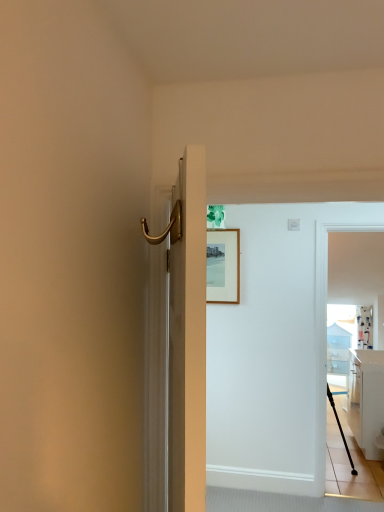
This screenshot has height=512, width=384. Describe the element at coordinates (325, 326) in the screenshot. I see `white glossy screen door at right` at that location.

What do you see at coordinates (364, 327) in the screenshot?
I see `white fabric curtain at upper right` at bounding box center [364, 327].

This screenshot has width=384, height=512. In order to click on wooden picture frame at upper center in this screenshot , I will do `click(223, 266)`.

This screenshot has width=384, height=512. I want to click on white glossy cabinet at right, so click(366, 399).

In order to face black rubber cane at right, should I rotate leftwards or rightwards?

To face it directly, rotate right by 18.050 degrees.

The image size is (384, 512). In order to click on white glossy countertop at right in this screenshot , I will do `click(369, 356)`.

Considering the positions of objects black matte tripod at lower right and white fabric curtain at upper right in the image provided, who is in front, black matte tripod at lower right or white fabric curtain at upper right?

black matte tripod at lower right is more forward.

Is black matte tripod at lower right smaller than white fabric curtain at upper right?

Actually, black matte tripod at lower right might be larger than white fabric curtain at upper right.

In the scene shown: From the image's perspective, is black matte tripod at lower right below white fabric curtain at upper right?

Correct, black matte tripod at lower right appears lower than white fabric curtain at upper right in the image.

Who is shorter, wooden picture frame at upper center or white glossy cabinet at right?

wooden picture frame at upper center.

Is point (217, 259) closer to camera compared to point (364, 379)?

Yes, point (217, 259) is in front of point (364, 379).

Based on the photo, from the image's perspective, is wooden picture frame at upper center positioned above or below white glossy cabinet at right?

wooden picture frame at upper center is situated higher than white glossy cabinet at right in the image.

Does white glossy countertop at right contain white glossy screen door at right?

No, white glossy screen door at right is not a part of white glossy countertop at right.

Is point (381, 354) less distant than point (316, 298)?

No, it is behind (316, 298).

Could you tell me if white glossy countertop at right is turned towards white glossy screen door at right?

No, white glossy countertop at right is not oriented towards white glossy screen door at right.

From a real-world perspective, does white glossy countertop at right stand above white glossy screen door at right?

Incorrect, from a real-world perspective, white glossy countertop at right is lower than white glossy screen door at right.

From a real-world perspective, is white fabric curtain at upper right positioned above or below white glossy screen door at right?

white fabric curtain at upper right is below white glossy screen door at right.

Are white fabric curtain at upper right and white glossy screen door at right beside each other?

There is a gap between white fabric curtain at upper right and white glossy screen door at right.

Considering the sizes of white fabric curtain at upper right and white glossy screen door at right in the image, is white fabric curtain at upper right taller or shorter than white glossy screen door at right?

white fabric curtain at upper right is shorter than white glossy screen door at right.

Is point (368, 356) in front of point (370, 341)?

Yes, point (368, 356) is closer to viewer.

Which of these two, white glossy countertop at right or white fabric curtain at upper right, is bigger?

With larger size is white glossy countertop at right.

Is white glossy countertop at right oriented away from white fabric curtain at upper right?

white glossy countertop at right is not turned away from white fabric curtain at upper right.

Would you consider white glossy countertop at right to be distant from white fabric curtain at upper right?

That's not correct — white glossy countertop at right is a little close to white fabric curtain at upper right.

Considering the positions of points (230, 242) and (315, 274), is point (230, 242) farther from camera compared to point (315, 274)?

Yes, point (230, 242) is behind point (315, 274).

Could white glossy screen door at right be considered to be inside wooden picture frame at upper center?

No, white glossy screen door at right is not a part of wooden picture frame at upper center.

Is wooden picture frame at upper center facing towards white glossy screen door at right?

No.

From the image's perspective, between wooden picture frame at upper center and white glossy screen door at right, who is located below?

white glossy screen door at right appears lower in the image.

How many degrees apart are the facing directions of white glossy screen door at right and black matte tripod at lower right?

179 degrees separate the facing orientations of white glossy screen door at right and black matte tripod at lower right.

Is white glossy screen door at right outside of black matte tripod at lower right?

Yes, white glossy screen door at right is not within black matte tripod at lower right.

Which is in front, white glossy screen door at right or black matte tripod at lower right?

white glossy screen door at right.

Considering the points (324, 347) and (356, 471), which point is in front, point (324, 347) or point (356, 471)?

The point (324, 347) is closer.

Where is `curtain above the black matte tripod at lower right (from the image's perspective)`? The height and width of the screenshot is (512, 384). curtain above the black matte tripod at lower right (from the image's perspective) is located at coordinates (364, 327).

The height and width of the screenshot is (512, 384). I want to click on cabinetry that appears behind the wooden picture frame at upper center, so click(x=366, y=399).

Looking at the image, which one is located closer to white glossy countertop at right, black rubber cane at right or white glossy screen door at right?

black rubber cane at right lies closer to white glossy countertop at right than the other object.

When comparing their distances from black matte tripod at lower right, does black rubber cane at right or white glossy screen door at right seem further?

Among the two, white glossy screen door at right is located further to black matte tripod at lower right.

When comparing their distances from wooden picture frame at upper center, does white fabric curtain at upper right or white glossy cabinet at right seem further?

white fabric curtain at upper right is positioned further to the anchor wooden picture frame at upper center.

When comparing their distances from white glossy cabinet at right, does white glossy countertop at right or white fabric curtain at upper right seem further?

Based on the image, white fabric curtain at upper right appears to be further to white glossy cabinet at right.

From the image, which object appears to be nearer to white glossy screen door at right, white glossy cabinet at right or wooden picture frame at upper center?

wooden picture frame at upper center is closer to white glossy screen door at right.

Considering their positions, is black rubber cane at right positioned further to wooden picture frame at upper center than white glossy cabinet at right?

black rubber cane at right.

Which object lies further to the anchor point white glossy screen door at right, wooden picture frame at upper center or white fabric curtain at upper right?

white fabric curtain at upper right is positioned further to the anchor white glossy screen door at right.

From the image, which object appears to be nearer to white glossy countertop at right, white glossy cabinet at right or white fabric curtain at upper right?

white glossy cabinet at right is closer to white glossy countertop at right.

I want to click on cabinetry between wooden picture frame at upper center and black rubber cane at right in the up-down direction, so click(x=366, y=399).

Find the location of `tripod between white glossy screen door at right and white fabric curtain at upper right in the front-back direction`. tripod between white glossy screen door at right and white fabric curtain at upper right in the front-back direction is located at coordinates (341, 429).

Image resolution: width=384 pixels, height=512 pixels. In order to click on tripod between white glossy screen door at right and black rubber cane at right vertically in this screenshot , I will do `click(341, 429)`.

This screenshot has width=384, height=512. What are the coordinates of `cabinetry between wooden picture frame at upper center and white fabric curtain at upper right from left to right` in the screenshot? It's located at (366, 399).